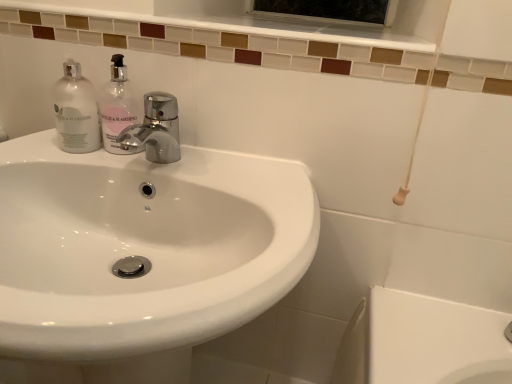
Question: Can you confirm if white glossy sink at center is positioned to the left of translucent glass soap dispenser at upper left?

Choices:
 (A) no
 (B) yes

Answer: (B)

Question: Would you say white glossy sink at center contains translucent glass soap dispenser at upper left?

Choices:
 (A) yes
 (B) no

Answer: (B)

Question: From a real-world perspective, does white glossy sink at center stand above translucent glass soap dispenser at upper left?

Choices:
 (A) no
 (B) yes

Answer: (A)

Question: Could you tell me if white glossy sink at center is facing translucent glass soap dispenser at upper left?

Choices:
 (A) yes
 (B) no

Answer: (B)

Question: From the image's perspective, is white glossy sink at center located beneath translucent glass soap dispenser at upper left?

Choices:
 (A) yes
 (B) no

Answer: (A)

Question: Does white glossy sink at center have a smaller size compared to translucent glass soap dispenser at upper left?

Choices:
 (A) yes
 (B) no

Answer: (B)

Question: Is the position of translucent glass soap dispenser at upper left less distant than that of clear glass bottle at left?

Choices:
 (A) no
 (B) yes

Answer: (B)

Question: Is clear glass bottle at left located within translucent glass soap dispenser at upper left?

Choices:
 (A) no
 (B) yes

Answer: (A)

Question: Does translucent glass soap dispenser at upper left have a lesser width compared to clear glass bottle at left?

Choices:
 (A) no
 (B) yes

Answer: (B)

Question: Can you confirm if translucent glass soap dispenser at upper left is bigger than clear glass bottle at left?

Choices:
 (A) yes
 (B) no

Answer: (B)

Question: Is the surface of translucent glass soap dispenser at upper left in direct contact with clear glass bottle at left?

Choices:
 (A) yes
 (B) no

Answer: (A)

Question: Is the depth of translucent glass soap dispenser at upper left greater than that of clear glass bottle at left?

Choices:
 (A) yes
 (B) no

Answer: (B)

Question: From the image's perspective, is clear glass bottle at left over white glossy sink at center?

Choices:
 (A) yes
 (B) no

Answer: (A)